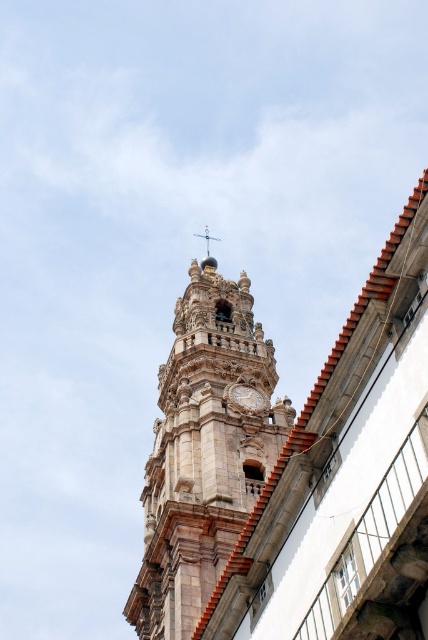
Looking at this image, who is more forward, (139, 580) or (258, 404)?

Point (139, 580)

Between stone clock tower at center and white stone clock at upper center, which one appears on the left side from the viewer's perspective?

Positioned to the left is stone clock tower at center.

Measure the distance between point (288, 419) and camera.

Point (288, 419) is 265.52 feet away from camera.

Find the location of a particular element. The width and height of the screenshot is (428, 640). stone clock tower at center is located at coordinates (204, 452).

Is point (243, 401) closer to viewer compared to point (204, 268)?

Yes, point (243, 401) is in front of point (204, 268).

Does white stone clock at upper center appear on the right side of gold textured dome at upper center?

Yes, white stone clock at upper center is to the right of gold textured dome at upper center.

Measure the distance between point (262,394) and camera.

Point (262,394) and camera are 82.80 meters apart from each other.

The height and width of the screenshot is (640, 428). Identify the location of white stone clock at upper center. (246, 397).

Is point (178, 305) behind point (213, 266)?

That is False.

Between stone clock tower at center and gold textured dome at upper center, which one is positioned higher?

gold textured dome at upper center is higher up.

What do you see at coordinates (204, 452) in the screenshot? The width and height of the screenshot is (428, 640). I see `stone clock tower at center` at bounding box center [204, 452].

Image resolution: width=428 pixels, height=640 pixels. I want to click on stone clock tower at center, so click(x=204, y=452).